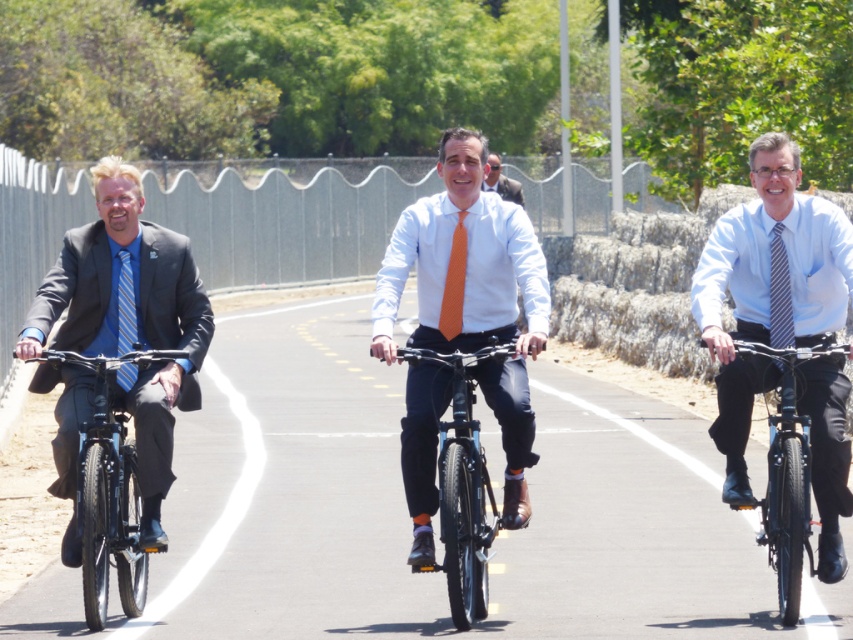
You are a photographer trying to capture a clear photo of the light blue shirt and tie at center and the blue striped tie at left. Since you want both subjects to appear equally prominent in the photo, which one should you zoom in on more?

You should zoom in more on the blue striped tie at left because it is smaller than the light blue shirt and tie at center, making them appear equally prominent in the photo.

You are a photographer positioned at the center of the road. You want to capture a photo that includes both the matte black suit at left and the striped fabric tie at center. Considering the distance between them, will you be able to frame both subjects in a single shot without moving your camera?

The distance between the matte black suit at left and the striped fabric tie at center is 11.40 feet. Depending on the camera lens and zoom level, it is possible to frame both subjects in a single shot without moving the camera, as 11.40 feet is a manageable distance for most standard lenses.